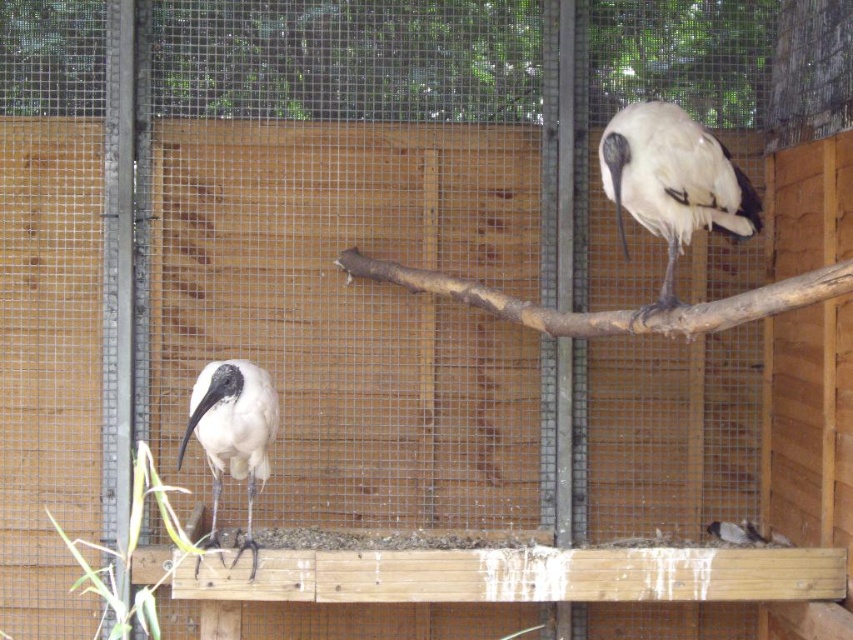
Who is lower down, white matte bird at upper right or white matte ibis at lower left?

white matte ibis at lower left is below.

Does white matte bird at upper right come behind white matte ibis at lower left?

That is False.

At what (x,y) coordinates should I click in order to perform the action: click on white matte bird at upper right. Please return your answer as a coordinate pair (x, y). The image size is (853, 640). Looking at the image, I should click on (672, 182).

Between white matte ibis at lower left and white feathered bird at lower center, which one has more height?

Standing taller between the two is white matte ibis at lower left.

Who is positioned more to the right, white matte ibis at lower left or white feathered bird at lower center?

Positioned to the right is white feathered bird at lower center.

Between point (242, 442) and point (751, 540), which one is positioned in front?

Point (242, 442)

Identify the location of white matte ibis at lower left. This screenshot has width=853, height=640. (231, 435).

Is white matte bird at upper right to the left of white feathered bird at lower center from the viewer's perspective?

Indeed, white matte bird at upper right is positioned on the left side of white feathered bird at lower center.

Can you confirm if white matte bird at upper right is taller than white feathered bird at lower center?

Correct, white matte bird at upper right is much taller as white feathered bird at lower center.

Who is more forward, (625,202) or (727,522)?

Positioned in front is point (625,202).

The image size is (853, 640). What are the coordinates of `white matte bird at upper right` in the screenshot? It's located at (672, 182).